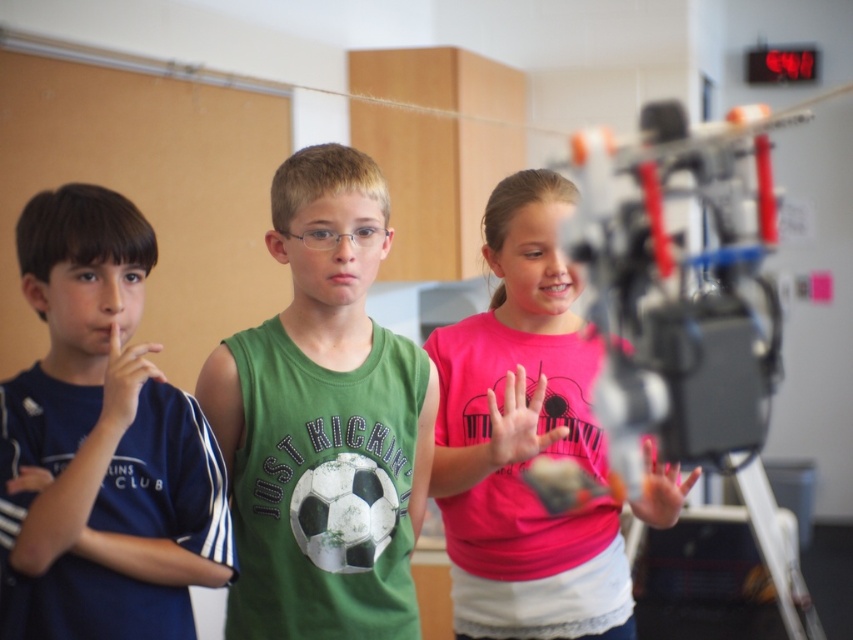
The image size is (853, 640). I want to click on pink matte shirt at center, so click(524, 438).

Is the position of pink matte shirt at center less distant than that of smooth skin hand at center?

That is True.

Image resolution: width=853 pixels, height=640 pixels. Identify the location of pink matte shirt at center. (524, 438).

Is the position of green matte tank top at center less distant than that of pink matte hand at center?

Yes.

Does green matte tank top at center appear under pink matte hand at center?

Actually, green matte tank top at center is above pink matte hand at center.

The image size is (853, 640). What do you see at coordinates (323, 422) in the screenshot? I see `green matte tank top at center` at bounding box center [323, 422].

The height and width of the screenshot is (640, 853). I want to click on green matte tank top at center, so click(323, 422).

This screenshot has width=853, height=640. I want to click on metallic/plastic camera at right, so click(685, 308).

Describe the element at coordinates (685, 308) in the screenshot. I see `metallic/plastic camera at right` at that location.

Find the location of a particular element. This screenshot has width=853, height=640. metallic/plastic camera at right is located at coordinates (685, 308).